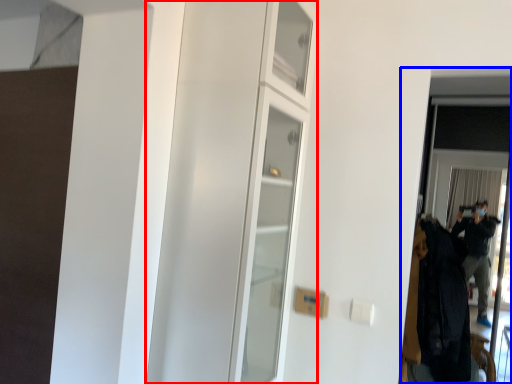
Question: Which of the following is the farthest to the observer, dresser (highlighted by a red box) or screen door (highlighted by a blue box)?

Choices:
 (A) dresser
 (B) screen door

Answer: (B)